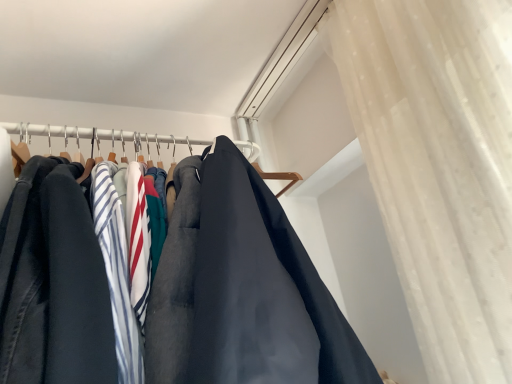
What do you see at coordinates (98, 136) in the screenshot?
I see `dark gray fabric pants at left` at bounding box center [98, 136].

What is the approximate width of dark gray fabric pants at left?

27.10 centimeters.

The image size is (512, 384). In order to click on dark gray fabric pants at left in this screenshot , I will do `click(98, 136)`.

Where is `sheer white curtain at upper right`? The height and width of the screenshot is (384, 512). sheer white curtain at upper right is located at coordinates (439, 165).

Describe the element at coordinates (439, 165) in the screenshot. I see `sheer white curtain at upper right` at that location.

Where is `dark gray fabric pants at left`? This screenshot has height=384, width=512. dark gray fabric pants at left is located at coordinates (98, 136).

In the image, is sheer white curtain at upper right on the left side or the right side of dark gray fabric pants at left?

sheer white curtain at upper right is positioned on dark gray fabric pants at left's right side.

Which object is closer to the camera, sheer white curtain at upper right or dark gray fabric pants at left?

sheer white curtain at upper right is closer to the camera.

Is point (457, 340) positioned in front of point (93, 139)?

Yes, point (457, 340) is in front of point (93, 139).

From the image's perspective, which one is positioned lower, sheer white curtain at upper right or dark gray fabric pants at left?

dark gray fabric pants at left appears lower in the image.

In the scene shown: From a real-world perspective, is sheer white curtain at upper right physically above dark gray fabric pants at left?

Incorrect, from a real-world perspective, sheer white curtain at upper right is lower than dark gray fabric pants at left.

Can you confirm if sheer white curtain at upper right is wider than dark gray fabric pants at left?

Indeed, sheer white curtain at upper right has a greater width compared to dark gray fabric pants at left.

Which of these two, sheer white curtain at upper right or dark gray fabric pants at left, stands shorter?

dark gray fabric pants at left is shorter.

In terms of size, does sheer white curtain at upper right appear bigger or smaller than dark gray fabric pants at left?

Clearly, sheer white curtain at upper right is larger in size than dark gray fabric pants at left.

Would you say dark gray fabric pants at left is part of sheer white curtain at upper right's contents?

Definitely not — dark gray fabric pants at left is not inside sheer white curtain at upper right.

Is sheer white curtain at upper right far away from dark gray fabric pants at left?

They are positioned close to each other.

Is dark gray fabric pants at left at the back of sheer white curtain at upper right?

No, dark gray fabric pants at left is not at the back of sheer white curtain at upper right.

You are a GUI agent. You are given a task and a screenshot of the screen. Output one action in this format:
    pyautogui.click(x=<x>, y=<y>)
    Task: Click on the closet on the left of sheer white curtain at upper right
    Image resolution: width=512 pixels, height=384 pixels.
    Given the screenshot: What is the action you would take?
    pyautogui.click(x=98, y=136)

Does dark gray fabric pants at left appear on the left side of sheer white curtain at upper right?

Correct, you'll find dark gray fabric pants at left to the left of sheer white curtain at upper right.

Which is behind, dark gray fabric pants at left or sheer white curtain at upper right?

dark gray fabric pants at left is behind.

Which is in front, point (234, 142) or point (423, 303)?

The point (423, 303) is in front.

From the image's perspective, is dark gray fabric pants at left above or below sheer white curtain at upper right?

dark gray fabric pants at left is situated lower than sheer white curtain at upper right in the image.

From a real-world perspective, who is located lower, dark gray fabric pants at left or sheer white curtain at upper right?

Answer: In real-world perspective, sheer white curtain at upper right is lower.

Does dark gray fabric pants at left have a greater width compared to sheer white curtain at upper right?

No.

Does dark gray fabric pants at left have a lesser height compared to sheer white curtain at upper right?

Correct, dark gray fabric pants at left is not as tall as sheer white curtain at upper right.

Considering the relative sizes of dark gray fabric pants at left and sheer white curtain at upper right in the image provided, is dark gray fabric pants at left smaller than sheer white curtain at upper right?

Yes.

Is dark gray fabric pants at left inside the boundaries of sheer white curtain at upper right, or outside?

dark gray fabric pants at left is located beyond the bounds of sheer white curtain at upper right.

Would you consider dark gray fabric pants at left to be distant from sheer white curtain at upper right?

No, dark gray fabric pants at left is not far from sheer white curtain at upper right.

Is dark gray fabric pants at left looking in the opposite direction of sheer white curtain at upper right?

No, dark gray fabric pants at left's orientation is not away from sheer white curtain at upper right.

How different are the orientations of dark gray fabric pants at left and sheer white curtain at upper right in degrees?

The facing directions of dark gray fabric pants at left and sheer white curtain at upper right are 89.7 degrees apart.

Locate an element on the screen. Image resolution: width=512 pixels, height=384 pixels. closet behind the sheer white curtain at upper right is located at coordinates (98, 136).

In the image, there is a sheer white curtain at upper right. Where is `closet below it (from the image's perspective)`? Image resolution: width=512 pixels, height=384 pixels. closet below it (from the image's perspective) is located at coordinates pos(98,136).

Locate an element on the screen. The image size is (512, 384). closet above the sheer white curtain at upper right (from a real-world perspective) is located at coordinates (98, 136).